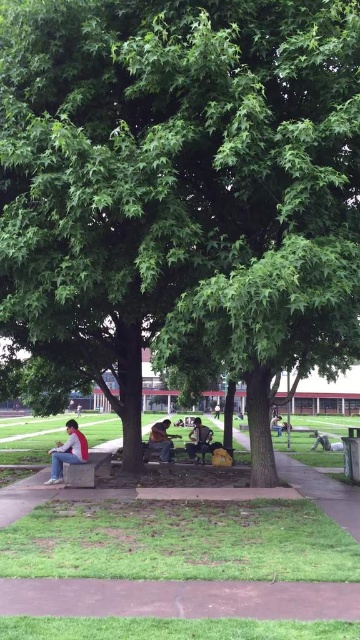
Question: Can you confirm if concrete bench at lower center is positioned to the right of concrete bench at lower left?

Choices:
 (A) yes
 (B) no

Answer: (A)

Question: Based on their relative distances, which object is farther from the brown leather jacket at center?

Choices:
 (A) brown dirt path at lower center
 (B) white shirt at center

Answer: (B)

Question: Which of the following is the closest to the observer?

Choices:
 (A) denim jeans at lower left
 (B) brown dirt path at lower center
 (C) brown leather jacket at center

Answer: (B)

Question: Is brown dirt path at lower center above dark gray fabric jacket at center?

Choices:
 (A) yes
 (B) no

Answer: (A)

Question: Is concrete bench at lower center to the right of brown leather jacket at center from the viewer's perspective?

Choices:
 (A) no
 (B) yes

Answer: (B)

Question: Considering the real-world distances, which object is farthest from the white shirt at center?

Choices:
 (A) dark gray fabric jacket at center
 (B) brown leather jacket at center
 (C) brown dirt path at lower center
 (D) concrete bench at lower left

Answer: (C)